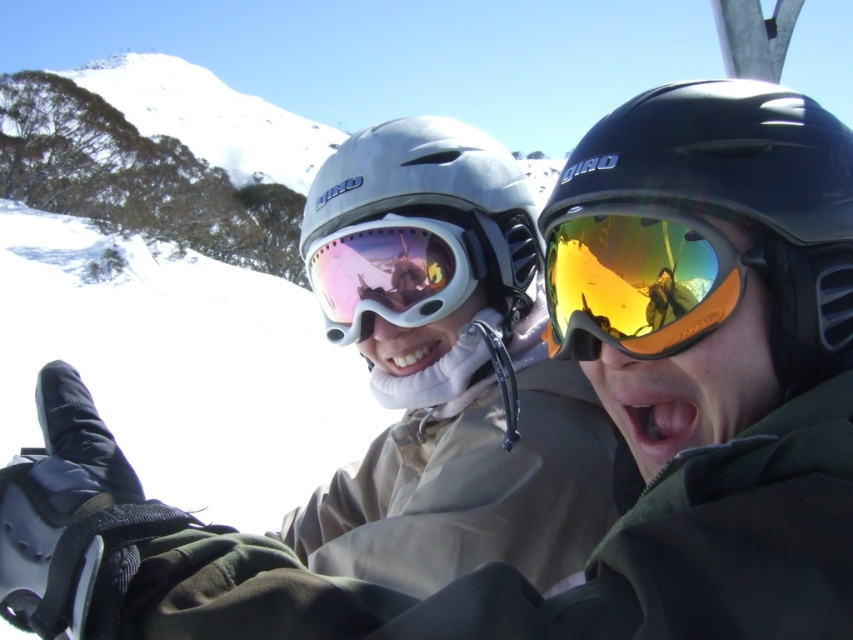
Question: Does black matte helmet at right have a smaller size compared to gold reflective lens at center?

Choices:
 (A) yes
 (B) no

Answer: (B)

Question: Considering the real-world distances, which object is closest to the black matte helmet at right?

Choices:
 (A) gold reflective lens at center
 (B) matte gray helmet at center
 (C) pink reflective lens goggles at center

Answer: (A)

Question: Among these objects, which one is nearest to the camera?

Choices:
 (A) black matte helmet at right
 (B) pink reflective lens goggles at center
 (C) gold reflective lens at center
 (D) matte gray helmet at center

Answer: (A)

Question: Does matte gray helmet at center have a greater width compared to gold reflective lens at center?

Choices:
 (A) no
 (B) yes

Answer: (B)

Question: Based on their relative distances, which object is farther from the pink reflective lens goggles at center?

Choices:
 (A) matte gray helmet at center
 (B) gold reflective lens at center

Answer: (B)

Question: Can you confirm if black matte helmet at right is positioned below pink reflective lens goggles at center?

Choices:
 (A) no
 (B) yes

Answer: (A)